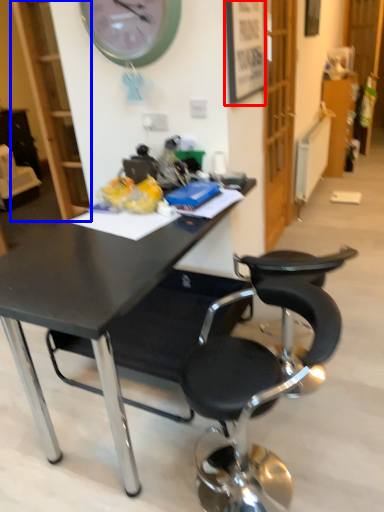
Question: Which object is further to the camera taking this photo, picture frame (highlighted by a red box) or bookshelf (highlighted by a blue box)?

Choices:
 (A) picture frame
 (B) bookshelf

Answer: (B)